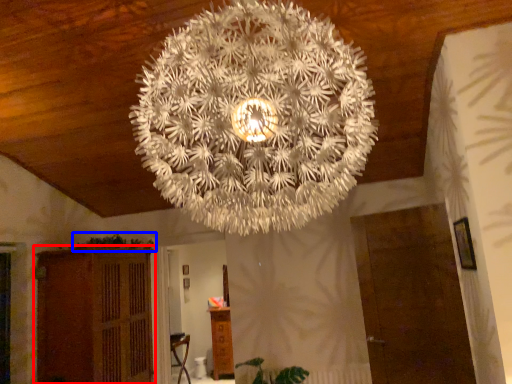
Question: Which point is further to the camera, furniture (highlighted by a red box) or plant (highlighted by a blue box)?

Choices:
 (A) furniture
 (B) plant

Answer: (B)